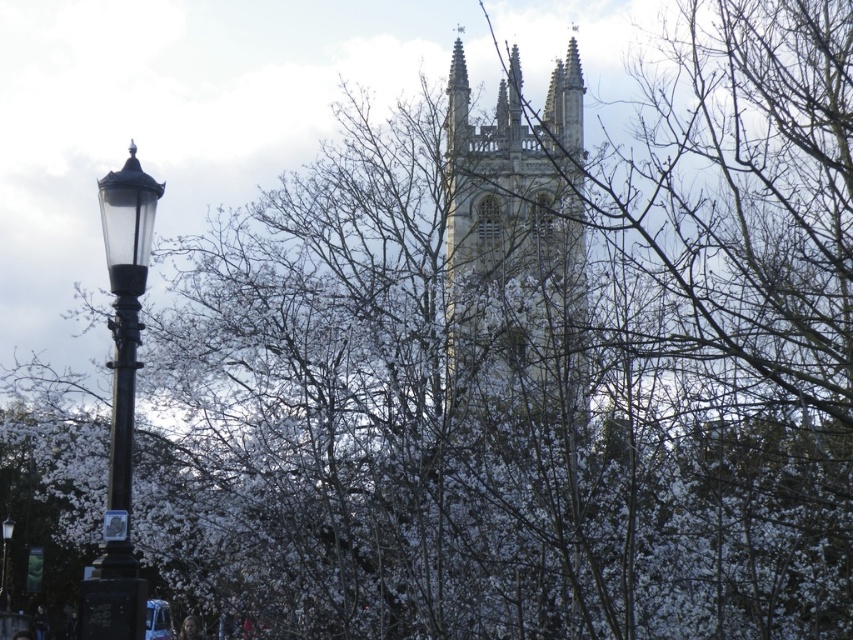
You are a photographer trying to capture the white stone church at upper center and the black glass street light at left in the same frame. Based on their positions and sizes, which object should you focus on first to ensure both are visible in your photo?

The white stone church at upper center might be wider than the black glass street light at left, so you should focus on the white stone church at upper center first to ensure both fit in the frame.

You are an architect visiting the historic site. You notice the white stone church at upper center and the polished black lamp post at left. Which structure appears taller in the image?

The polished black lamp post at left appears taller than the white stone church at upper center in the image.